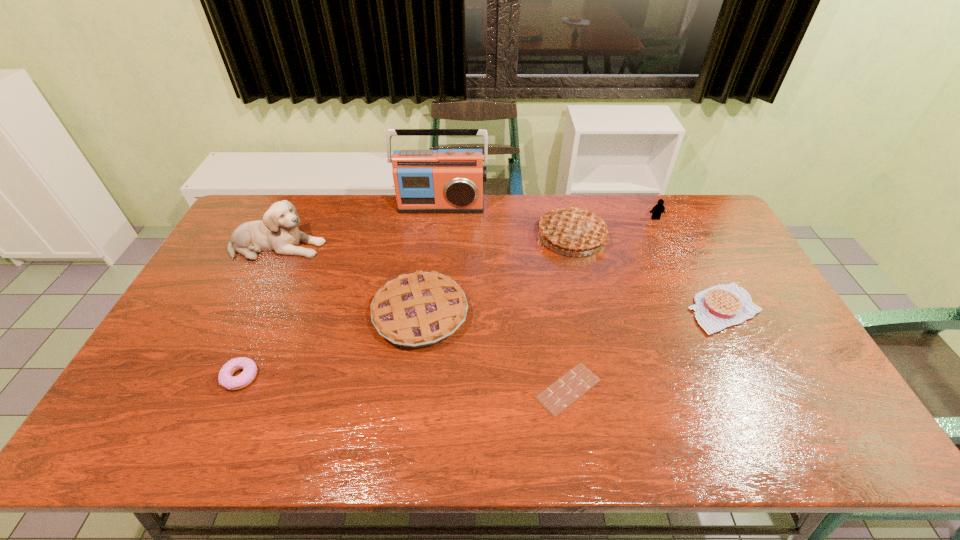
Locate an element on the screen. Image resolution: width=960 pixels, height=540 pixels. puppy at the far edge is located at coordinates (278, 231).

Identify the location of Lego situated at the far edge. (658, 209).

The width and height of the screenshot is (960, 540). I want to click on object located at the near edge, so click(559, 395).

This screenshot has height=540, width=960. In order to click on object located at the left edge in this screenshot , I will do `click(278, 231)`.

The height and width of the screenshot is (540, 960). What are the coordinates of `object present at the right edge` in the screenshot? It's located at (723, 305).

At what (x,y) coordinates should I click in order to perform the action: click on object present at the far left corner. Please return your answer as a coordinate pair (x, y). The image size is (960, 540). Looking at the image, I should click on (278, 231).

Image resolution: width=960 pixels, height=540 pixels. Identify the location of free location at the far edge. (612, 228).

Image resolution: width=960 pixels, height=540 pixels. In order to click on free region at the near edge in this screenshot , I will do `click(196, 418)`.

This screenshot has width=960, height=540. Find the location of `vacant space at the right edge`. vacant space at the right edge is located at coordinates (775, 344).

Where is `vacant space at the far right corner of the desktop`? The width and height of the screenshot is (960, 540). vacant space at the far right corner of the desktop is located at coordinates (684, 207).